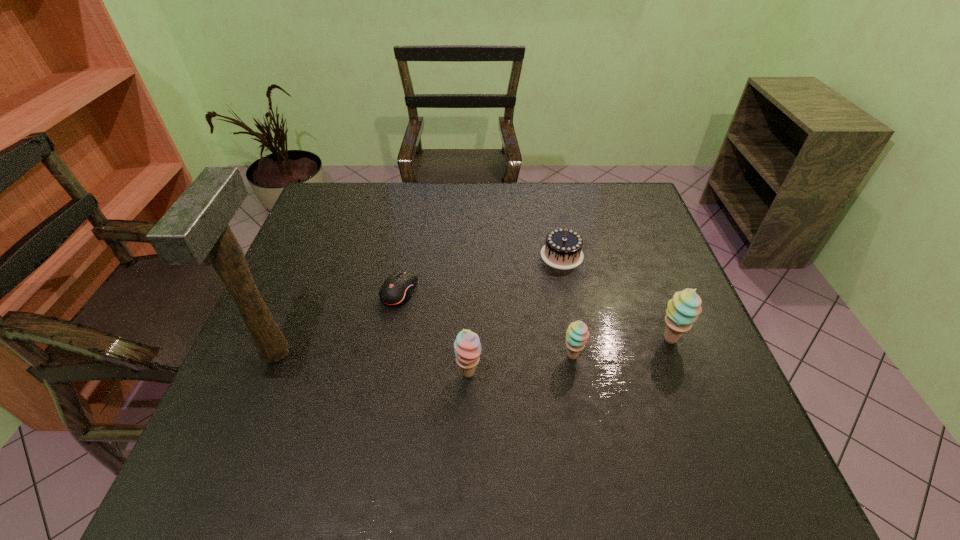
Please point out where to position a new sherbert on the left to maintain spacing. Please provide its 2D coordinates. Your answer should be formatted as a tuple, i.e. [(x, y)], where the tuple contains the x and y coordinates of a point satisfying the conditions above.

[(356, 393)]